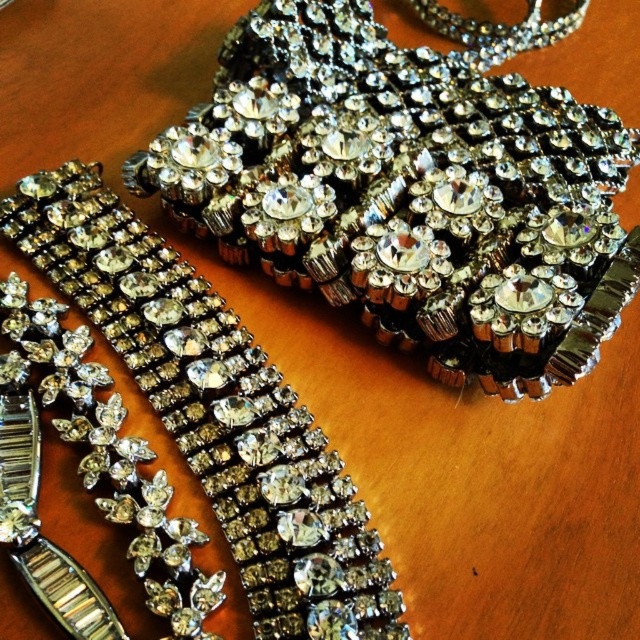
Does clear crystal rhinestone belt at upper center have a lesser width compared to clear crystal necklace at lower left?

No.

Where is `clear crystal rhinestone belt at upper center`? The width and height of the screenshot is (640, 640). clear crystal rhinestone belt at upper center is located at coordinates (408, 193).

Image resolution: width=640 pixels, height=640 pixels. Describe the element at coordinates (408, 193) in the screenshot. I see `clear crystal rhinestone belt at upper center` at that location.

Is point (582, 330) positioned in front of point (88, 218)?

Yes, it is.

Identify the location of clear crystal rhinestone belt at upper center. This screenshot has width=640, height=640. (408, 193).

Does clear crystal bracelet at center lie behind clear crystal necklace at lower left?

Yes.

Describe the element at coordinates (216, 410) in the screenshot. I see `clear crystal bracelet at center` at that location.

Measure the distance between clear crystal bracelet at center and camera.

A distance of 3.65 feet exists between clear crystal bracelet at center and camera.

Where is `clear crystal bracelet at center`? clear crystal bracelet at center is located at coordinates [x=216, y=410].